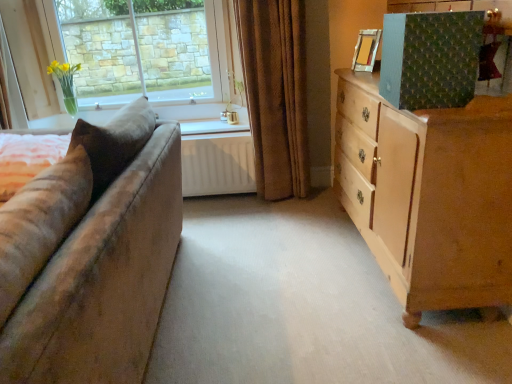
The image size is (512, 384). I want to click on free space that is in between light brown wooden chest of drawers at right and white matte radiator at center, so click(306, 239).